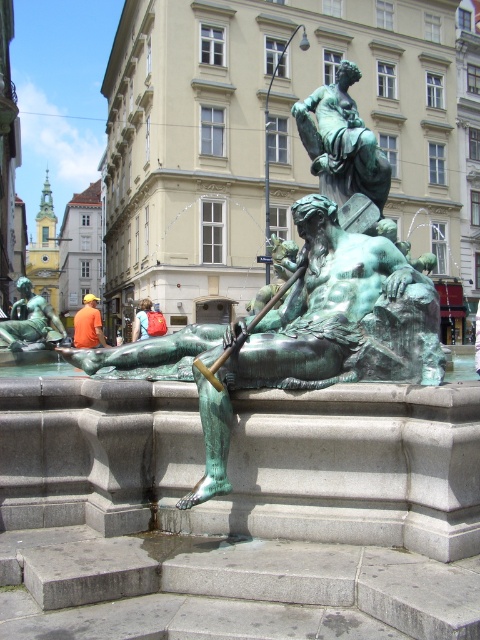
Question: Which of the following is the closest to the observer?

Choices:
 (A) green patina statue at upper center
 (B) orange fabric bag at center
 (C) green patina statue at lower left
 (D) orange fabric shirt at center

Answer: (A)

Question: Is green patina bronze statue at center further to the viewer compared to orange fabric bag at center?

Choices:
 (A) yes
 (B) no

Answer: (B)

Question: Where is green patina bronze statue at center located in relation to orange fabric shirt at center in the image?

Choices:
 (A) above
 (B) below

Answer: (B)

Question: Based on their relative distances, which object is nearer to the green patina statue at lower left?

Choices:
 (A) orange fabric shirt at center
 (B) green patina bronze statue at center
 (C) orange fabric bag at center

Answer: (C)

Question: Considering the real-world distances, which object is closest to the green patina statue at upper center?

Choices:
 (A) green patina statue at lower left
 (B) orange fabric shirt at center

Answer: (A)

Question: Can you confirm if green patina statue at upper center is positioned to the right of orange fabric shirt at center?

Choices:
 (A) yes
 (B) no

Answer: (A)